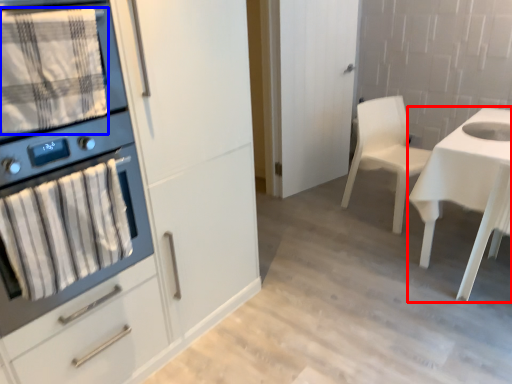
Question: Which object is further to the camera taking this photo, desk (highlighted by a red box) or blanket (highlighted by a blue box)?

Choices:
 (A) desk
 (B) blanket

Answer: (A)